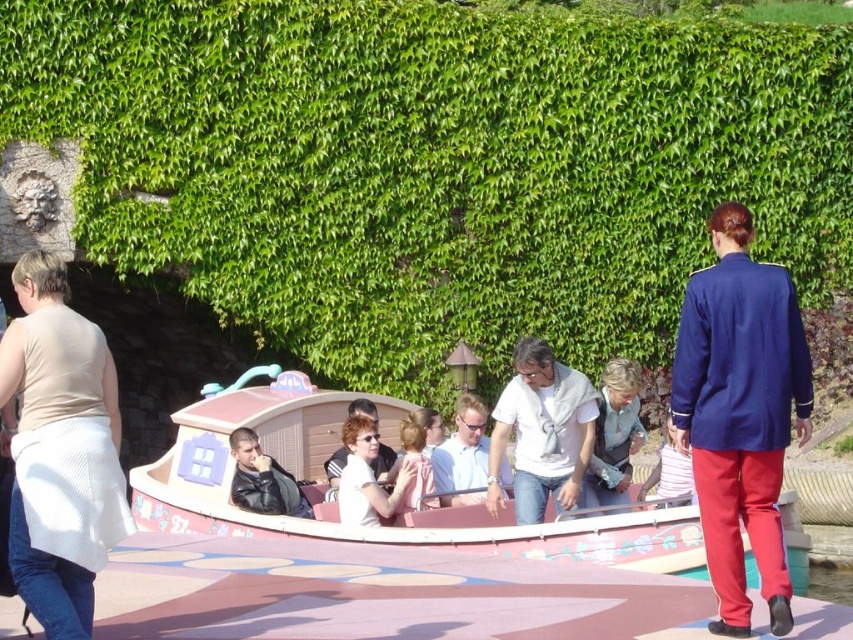
You are a photographer standing in front of the navy blue uniform at right and the light blue shirt at center. You want to take a photo that captures both subjects clearly. Which subject should you focus on first to ensure depth of field?

The navy blue uniform at right has a greater height compared to the light blue shirt at center, so you should focus on the navy blue uniform at right first to ensure both are in focus.

You are a photographer trying to capture a photo of the white knitwear at center and the green leafy hedge at upper center. To ensure both are in the frame, should you adjust your camera to the left or right?

The green leafy hedge at upper center is to the left of white knitwear at center, so you should adjust your camera to the left to include both in the frame.

You are a photographer trying to capture a candid shot of the passengers on the boat. You notice two items of clothing at the center of your viewfinder. The first is a matte white blouse at center, and the second is a leather jacket at center. Which one is positioned to the right side of the other?

The matte white blouse at center is positioned to the right of the leather jacket at center.